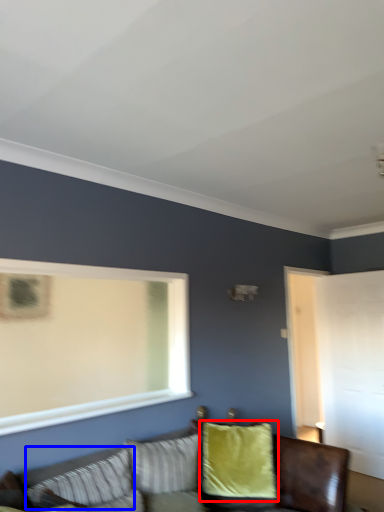
Question: Which point is further to the camera, pillow (highlighted by a red box) or pillow (highlighted by a blue box)?

Choices:
 (A) pillow
 (B) pillow

Answer: (A)